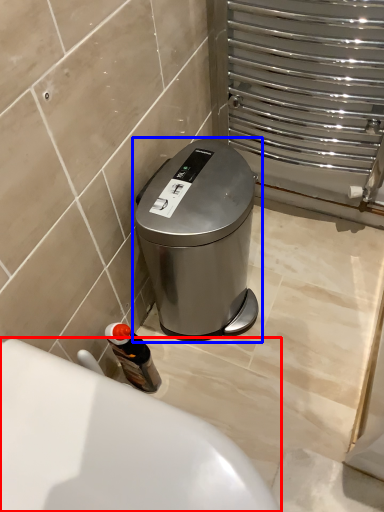
Question: Which of the following is the closest to the observer, bath (highlighted by a red box) or waste container (highlighted by a blue box)?

Choices:
 (A) bath
 (B) waste container

Answer: (A)